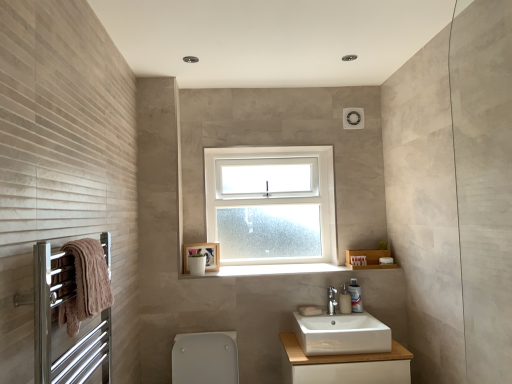
Question: Considering their positions, is brown towel at left located in front of or behind silver metallic towel rack at left?

Choices:
 (A) front
 (B) behind

Answer: (B)

Question: Considering the positions of brown towel at left and silver metallic towel rack at left in the image, is brown towel at left taller or shorter than silver metallic towel rack at left?

Choices:
 (A) short
 (B) tall

Answer: (A)

Question: Which object is positioned farthest from the white ceramic tap at center?

Choices:
 (A) white ceramic sink at center
 (B) white frosted glass window at center
 (C) white glossy soap dispenser at lower right
 (D) silver metallic towel rack at left
 (E) brown towel at left

Answer: (E)

Question: Estimate the real-world distances between objects in this image. Which object is closer to the silver metallic towel rack at left?

Choices:
 (A) white ceramic sink at center
 (B) white glossy soap dispenser at lower right
 (C) white smooth window sill at center
 (D) brown towel at left
 (E) white glossy toilet bowl at lower center

Answer: (D)